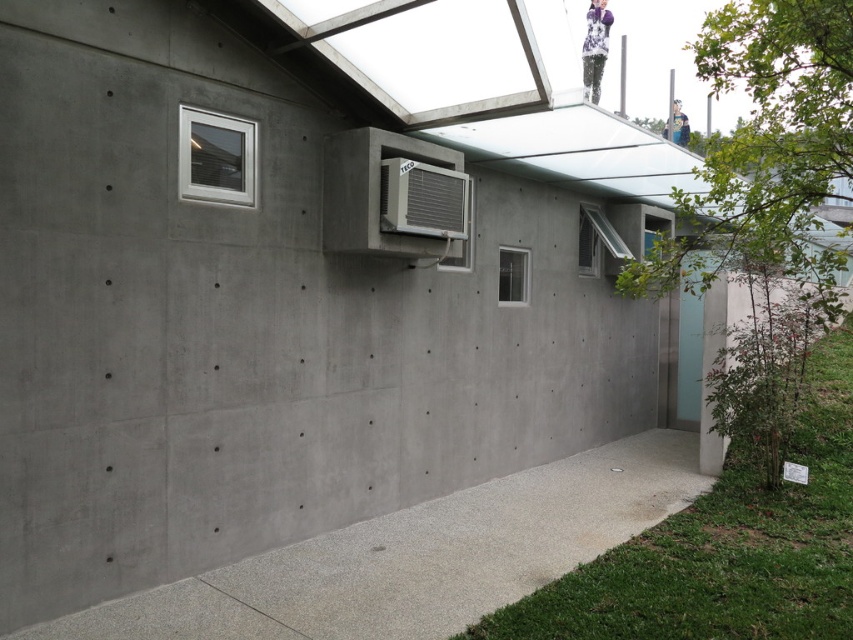
Question: Does white plastic window at upper left have a smaller size compared to clear glass window at center?

Choices:
 (A) no
 (B) yes

Answer: (A)

Question: Which object is positioned closest to the white plastic window at upper left?

Choices:
 (A) clear glass window at upper right
 (B) blue denim jacket at upper center
 (C) gray concrete at lower right
 (D) clear glass window at center

Answer: (C)

Question: Based on their relative distances, which object is nearer to the blue denim jacket at upper center?

Choices:
 (A) gray concrete at lower right
 (B) clear glass window at center
 (C) white plastic window at upper left

Answer: (B)

Question: Based on their relative distances, which object is nearer to the blue denim jacket at upper center?

Choices:
 (A) clear glass window at center
 (B) white plastic window at upper left
 (C) gray concrete at lower right
 (D) clear glass window at upper right

Answer: (D)

Question: Does clear glass window at center have a smaller size compared to blue denim jacket at upper center?

Choices:
 (A) no
 (B) yes

Answer: (B)

Question: Can you confirm if clear glass window at center is smaller than blue denim jacket at upper center?

Choices:
 (A) yes
 (B) no

Answer: (A)